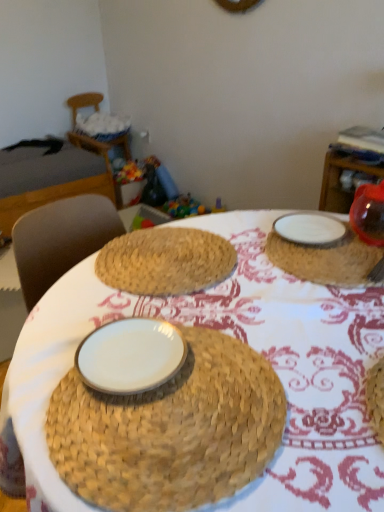
What are the coordinates of `empty space that is ontop of translucent plastic toy at center (from a real-world perspective)` in the screenshot? It's located at (180, 204).